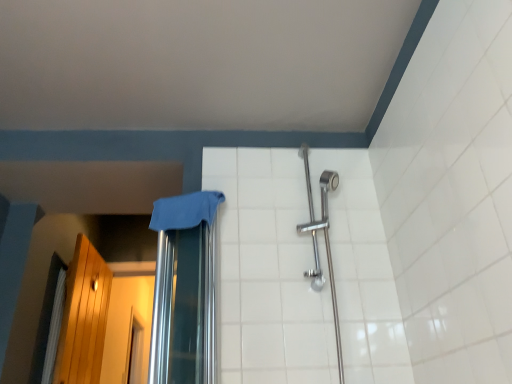
Question: From a real-world perspective, is blue fabric at center below white fabric shower curtain at left?

Choices:
 (A) no
 (B) yes

Answer: (A)

Question: Is blue fabric at center taller than white fabric shower curtain at left?

Choices:
 (A) yes
 (B) no

Answer: (B)

Question: Can you confirm if blue fabric at center is positioned to the right of white fabric shower curtain at left?

Choices:
 (A) yes
 (B) no

Answer: (A)

Question: Could white fabric shower curtain at left be considered to be inside blue fabric at center?

Choices:
 (A) yes
 (B) no

Answer: (B)

Question: Does blue fabric at center have a greater width compared to white fabric shower curtain at left?

Choices:
 (A) yes
 (B) no

Answer: (A)

Question: From the image's perspective, is blue fabric at center located beneath white fabric shower curtain at left?

Choices:
 (A) no
 (B) yes

Answer: (A)

Question: Is white ceramic tile at center at the back of wooden screen door at left?

Choices:
 (A) no
 (B) yes

Answer: (A)

Question: Would you say wooden screen door at left is outside white ceramic tile at center?

Choices:
 (A) no
 (B) yes

Answer: (B)

Question: Can white ceramic tile at center be found inside wooden screen door at left?

Choices:
 (A) yes
 (B) no

Answer: (B)

Question: Is wooden screen door at left not close to white ceramic tile at center?

Choices:
 (A) no
 (B) yes

Answer: (B)

Question: Does wooden screen door at left come behind white ceramic tile at center?

Choices:
 (A) no
 (B) yes

Answer: (B)

Question: From a real-world perspective, is wooden screen door at left positioned under white ceramic tile at center based on gravity?

Choices:
 (A) yes
 (B) no

Answer: (B)

Question: Is blue fabric at center completely or partially inside white fabric shower curtain at left?

Choices:
 (A) yes
 (B) no

Answer: (B)